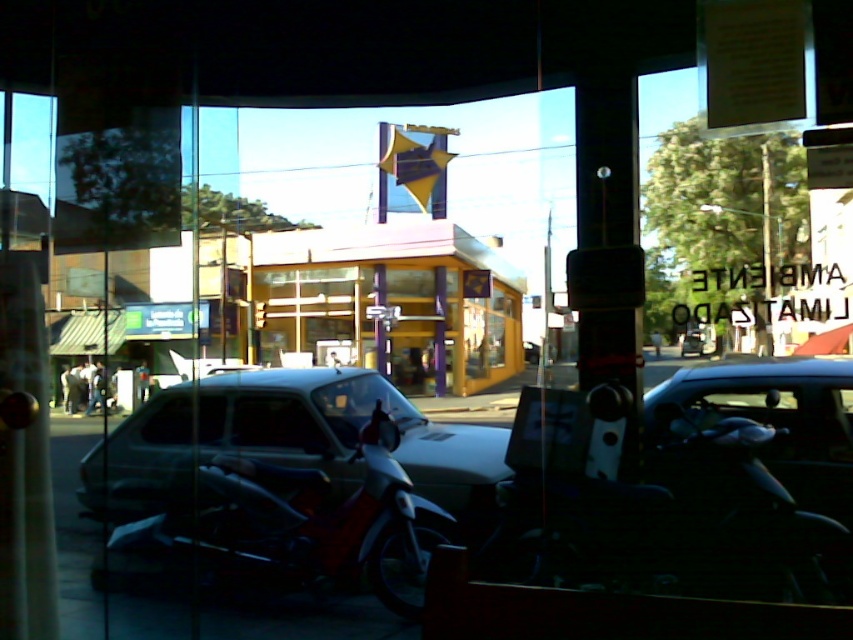
Does white matte car at center appear on the right side of shiny red motorcycle at lower left?

Incorrect, white matte car at center is not on the right side of shiny red motorcycle at lower left.

This screenshot has height=640, width=853. Describe the element at coordinates (285, 440) in the screenshot. I see `white matte car at center` at that location.

Where is `white matte car at center`? white matte car at center is located at coordinates (285, 440).

Which of these two, white matte car at center or metallic silver car at center, stands taller?

With more height is white matte car at center.

Is white matte car at center to the left of metallic silver car at center from the viewer's perspective?

Yes, white matte car at center is to the left of metallic silver car at center.

Is point (457, 502) positioned before point (791, 390)?

No, it is behind (791, 390).

Locate an element on the screen. The height and width of the screenshot is (640, 853). white matte car at center is located at coordinates (285, 440).

Does shiny red motorcycle at lower left have a smaller size compared to metallic silver car at center?

Actually, shiny red motorcycle at lower left might be larger than metallic silver car at center.

Image resolution: width=853 pixels, height=640 pixels. I want to click on shiny red motorcycle at lower left, so click(310, 524).